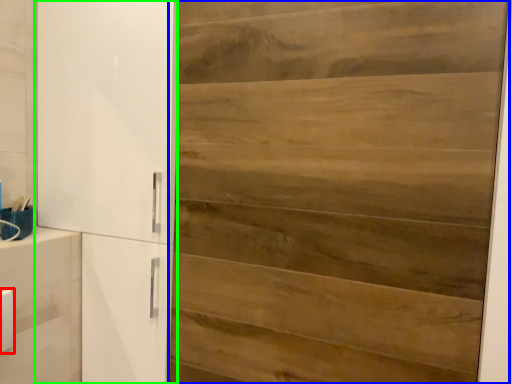
Question: Which is farther away from light switch (highlighted by a red box)? door (highlighted by a blue box) or cupboard (highlighted by a green box)?

Choices:
 (A) door
 (B) cupboard

Answer: (A)